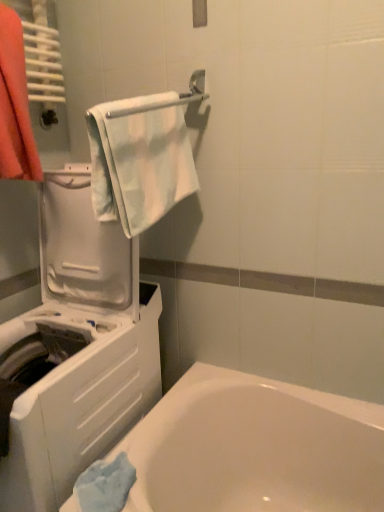
Question: Does light blue fabric towel at upper center appear on the left side of white glossy bathtub at lower left?

Choices:
 (A) no
 (B) yes

Answer: (B)

Question: From the image's perspective, is light blue fabric towel at upper center on white glossy bathtub at lower left?

Choices:
 (A) no
 (B) yes

Answer: (B)

Question: Are light blue fabric towel at upper center and white glossy bathtub at lower left located far from each other?

Choices:
 (A) no
 (B) yes

Answer: (A)

Question: Is light blue fabric towel at upper center oriented towards white glossy bathtub at lower left?

Choices:
 (A) no
 (B) yes

Answer: (A)

Question: From the image's perspective, does light blue fabric towel at upper center appear lower than white glossy bathtub at lower left?

Choices:
 (A) yes
 (B) no

Answer: (B)

Question: Relative to white glossy bathtub at lower left, is orange cotton towel at left in front or behind?

Choices:
 (A) behind
 (B) front

Answer: (A)

Question: In terms of width, does orange cotton towel at left look wider or thinner when compared to white glossy bathtub at lower left?

Choices:
 (A) thin
 (B) wide

Answer: (A)

Question: From the image's perspective, relative to white glossy bathtub at lower left, is orange cotton towel at left above or below?

Choices:
 (A) below
 (B) above

Answer: (B)

Question: Considering the positions of orange cotton towel at left and white glossy bathtub at lower left in the image, is orange cotton towel at left bigger or smaller than white glossy bathtub at lower left?

Choices:
 (A) small
 (B) big

Answer: (A)

Question: Is white plastic washing machine at left inside or outside of light blue fabric towel at upper center?

Choices:
 (A) inside
 (B) outside

Answer: (B)

Question: From the image's perspective, is white plastic washing machine at left positioned above or below light blue fabric towel at upper center?

Choices:
 (A) above
 (B) below

Answer: (B)

Question: Is point (74, 250) positioned closer to the camera than point (97, 145)?

Choices:
 (A) farther
 (B) closer

Answer: (A)

Question: Considering the positions of white plastic washing machine at left and light blue fabric towel at upper center in the image, is white plastic washing machine at left wider or thinner than light blue fabric towel at upper center?

Choices:
 (A) wide
 (B) thin

Answer: (A)

Question: Is white glossy towel bar at upper center in front of or behind white plastic washing machine at left in the image?

Choices:
 (A) front
 (B) behind

Answer: (B)

Question: Is white glossy towel bar at upper center taller or shorter than white plastic washing machine at left?

Choices:
 (A) tall
 (B) short

Answer: (B)